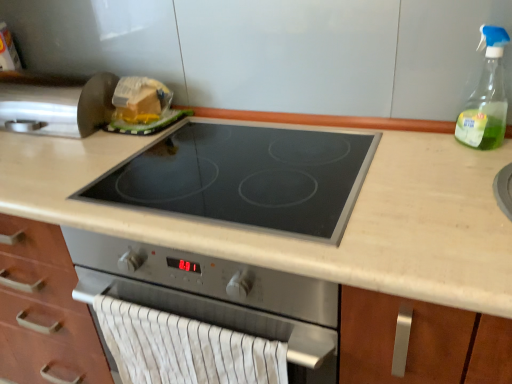
Locate an element on the screen. The height and width of the screenshot is (384, 512). free area in between translucent plastic cheese at upper left and clear glass spray bottle at upper right is located at coordinates pos(316,132).